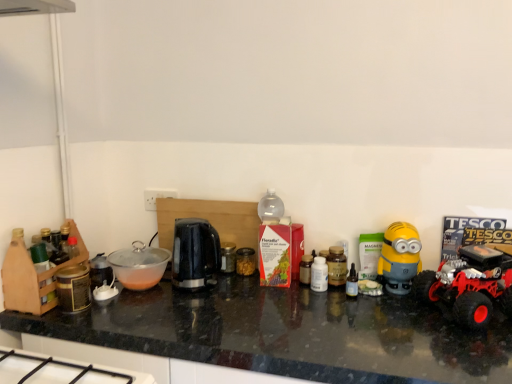
Image resolution: width=512 pixels, height=384 pixels. Identify the location of vacant region in front of white plastic bottle at center, marked as the third bottle in a right-to-left arrangement. (354, 319).